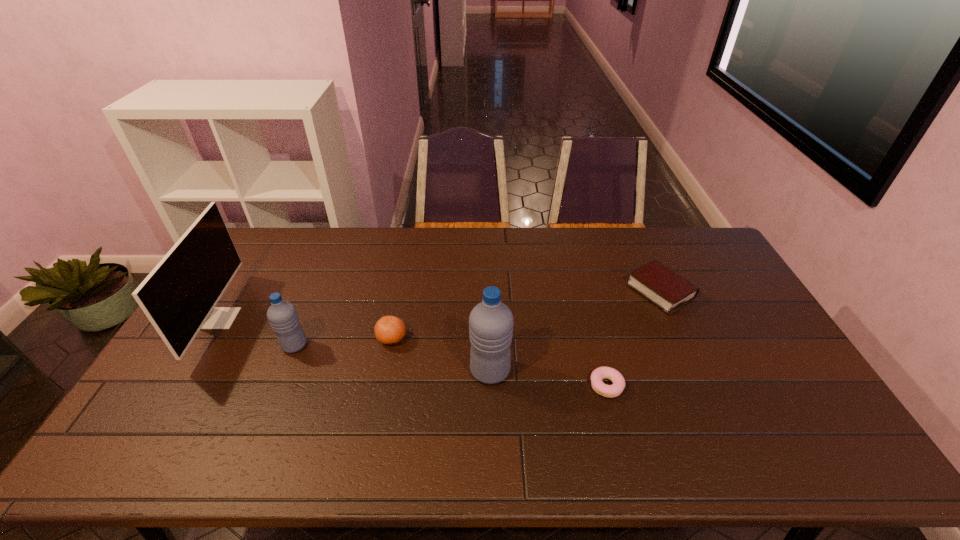
Locate an element on the screen. The width and height of the screenshot is (960, 540). unoccupied area between the Bible and the monitor is located at coordinates (440, 305).

Locate an element on the screen. vacant space that is in between the fourth shortest object and the right water bottle is located at coordinates (393, 358).

The width and height of the screenshot is (960, 540). What are the coordinates of `unoccupied position between the right water bottle and the clementine` in the screenshot? It's located at (441, 355).

Identify which object is the fourth nearest to the shorter water bottle. Please provide its 2D coordinates. Your answer should be formatted as a tuple, i.e. [(x, y)], where the tuple contains the x and y coordinates of a point satisfying the conditions above.

[(610, 391)]

I want to click on object that can be found as the third closest to the third object from right to left, so click(663, 287).

Locate an element on the screen. vacant position in the image that satisfies the following two spatial constraints: 1. on the front-facing side of the monitor; 2. on the left side of the clementine is located at coordinates (207, 339).

Identify the location of vacant space that satisfies the following two spatial constraints: 1. on the back side of the fourth object from right to left; 2. on the front-facing side of the monitor. (396, 318).

Image resolution: width=960 pixels, height=540 pixels. I want to click on vacant position in the image that satisfies the following two spatial constraints: 1. on the front side of the Bible; 2. on the front-facing side of the monitor, so click(672, 318).

Locate an element on the screen. The width and height of the screenshot is (960, 540). blank space that satisfies the following two spatial constraints: 1. on the front-facing side of the second object from right to left; 2. on the right side of the monitor is located at coordinates (179, 386).

The height and width of the screenshot is (540, 960). Identify the location of free region that satisfies the following two spatial constraints: 1. on the front-facing side of the doughnut; 2. on the right side of the monitor. (x=179, y=386).